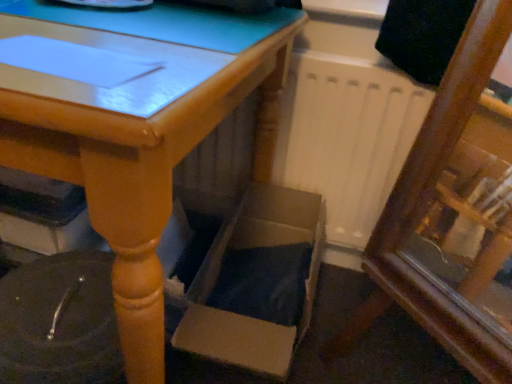
Describe the element at coordinates (137, 141) in the screenshot. I see `wooden table at center` at that location.

I want to click on wooden table at center, so click(x=137, y=141).

Locate an element on the screen. This screenshot has width=512, height=384. cardboard box at lower center is located at coordinates (257, 282).

Describe the element at coordinates (257, 282) in the screenshot. I see `cardboard box at lower center` at that location.

At what (x,y) coordinates should I click in order to perform the action: click on wooden table at center. Please return your answer as a coordinate pair (x, y). This screenshot has height=384, width=512. Looking at the image, I should click on (137, 141).

From the picture: Is cardboard box at lower center at the right side of wooden table at center?

Yes.

Does cardboard box at lower center lie in front of wooden table at center?

No, cardboard box at lower center is further to the viewer.

Considering the positions of point (246, 233) and point (92, 124), is point (246, 233) closer or farther from the camera than point (92, 124)?

Point (246, 233).

Based on the photo, from the image's perspective, is cardboard box at lower center above or below wooden table at center?

cardboard box at lower center is below wooden table at center.

From a real-world perspective, does cardboard box at lower center sit lower than wooden table at center?

Yes, from a real-world perspective, cardboard box at lower center is under wooden table at center.

Looking at their sizes, would you say cardboard box at lower center is wider or thinner than wooden table at center?

Considering their sizes, cardboard box at lower center looks slimmer than wooden table at center.

Can you confirm if cardboard box at lower center is taller than wooden table at center?

In fact, cardboard box at lower center may be shorter than wooden table at center.

Considering the relative sizes of cardboard box at lower center and wooden table at center in the image provided, is cardboard box at lower center smaller than wooden table at center?

Yes, cardboard box at lower center is smaller than wooden table at center.

Would you say cardboard box at lower center is outside wooden table at center?

No, cardboard box at lower center is not entirely external to wooden table at center.

Can you see cardboard box at lower center touching wooden table at center?

cardboard box at lower center and wooden table at center are not in contact.

Is cardboard box at lower center turned away from wooden table at center?

Yes, cardboard box at lower center is positioned with its back facing wooden table at center.

How distant is cardboard box at lower center from wooden table at center?

cardboard box at lower center is 13.23 inches from wooden table at center.

Find the location of `cardboard box lying on the right of wooden table at center`. cardboard box lying on the right of wooden table at center is located at coordinates (257, 282).

Considering the relative positions of wooden table at center and cardboard box at lower center in the image provided, is wooden table at center to the right of cardboard box at lower center from the viewer's perspective?

No, wooden table at center is not to the right of cardboard box at lower center.

Is wooden table at center positioned before cardboard box at lower center?

Yes.

Which is behind, point (45, 100) or point (272, 248)?

Point (272, 248)

From the image's perspective, which is below, wooden table at center or cardboard box at lower center?

From the image's view, cardboard box at lower center is below.

From a real-world perspective, which is physically above, wooden table at center or cardboard box at lower center?

wooden table at center is physically above.

Looking at their sizes, would you say wooden table at center is wider or thinner than cardboard box at lower center?

Considering their sizes, wooden table at center looks broader than cardboard box at lower center.

Is wooden table at center taller or shorter than cardboard box at lower center?

Considering their sizes, wooden table at center has more height than cardboard box at lower center.

Which of these two, wooden table at center or cardboard box at lower center, is bigger?

wooden table at center.

Choose the correct answer: Is wooden table at center inside cardboard box at lower center or outside it?

wooden table at center lies outside cardboard box at lower center.

Is the surface of wooden table at center in direct contact with cardboard box at lower center?

No, wooden table at center is not making contact with cardboard box at lower center.

Does wooden table at center turn towards cardboard box at lower center?

No, wooden table at center is not facing towards cardboard box at lower center.

How different are the orientations of wooden table at center and cardboard box at lower center in degrees?

3.67 degrees.

At what (x,y) coordinates should I click in order to perform the action: click on table in front of the cardboard box at lower center. Please return your answer as a coordinate pair (x, y). Looking at the image, I should click on (137, 141).

At what (x,y) coordinates should I click in order to perform the action: click on table located in front of the cardboard box at lower center. Please return your answer as a coordinate pair (x, y). The height and width of the screenshot is (384, 512). Looking at the image, I should click on (137, 141).

The width and height of the screenshot is (512, 384). Find the location of `cardboard box behind the wooden table at center`. cardboard box behind the wooden table at center is located at coordinates (257, 282).